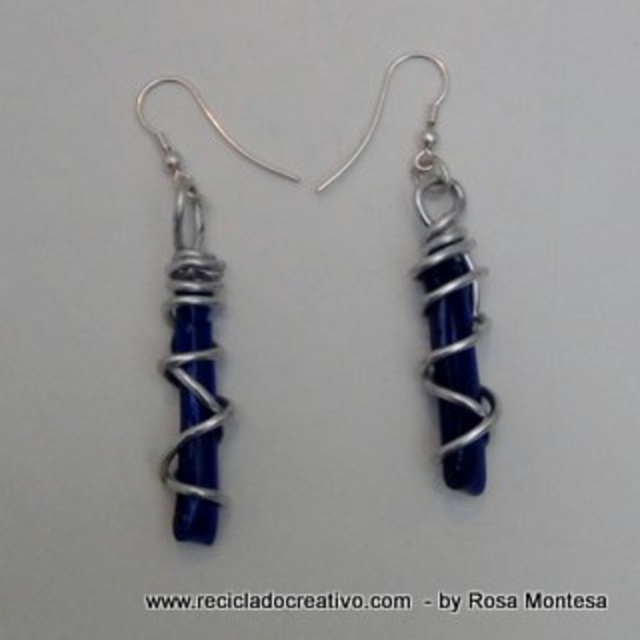
Who is shorter, satin blue stone at center or blue glass stone at left?

Standing shorter between the two is satin blue stone at center.

What do you see at coordinates (444, 300) in the screenshot? I see `satin blue stone at center` at bounding box center [444, 300].

This screenshot has height=640, width=640. What do you see at coordinates (444, 300) in the screenshot?
I see `satin blue stone at center` at bounding box center [444, 300].

Where is `satin blue stone at center`? This screenshot has width=640, height=640. satin blue stone at center is located at coordinates (444, 300).